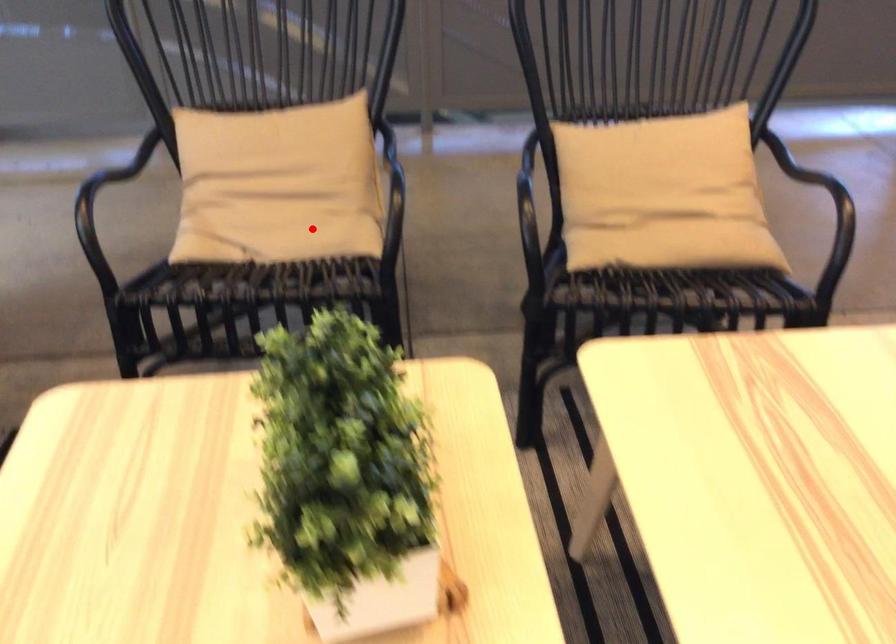
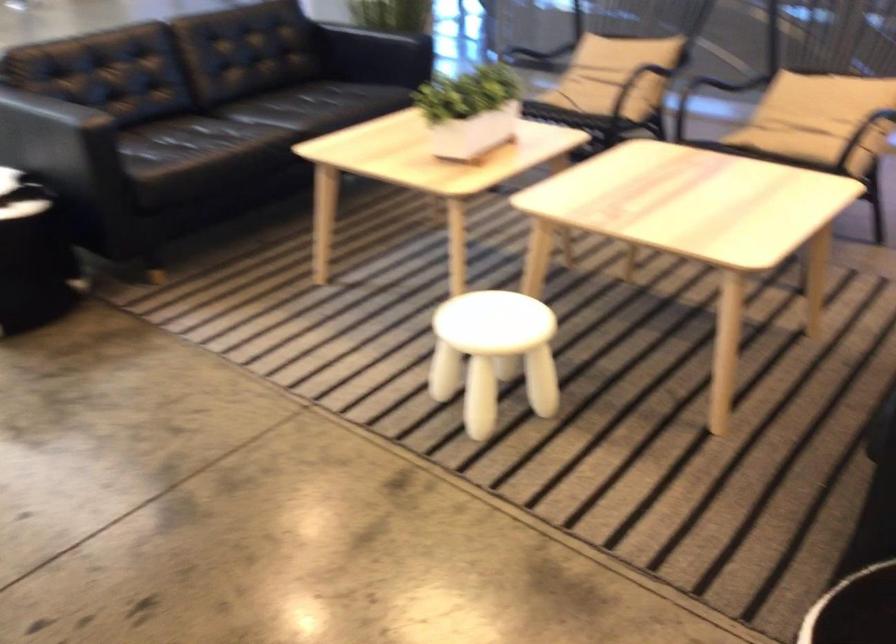
Find the pixel in the second image that matches the highlighted location in the first image.

(597, 91)